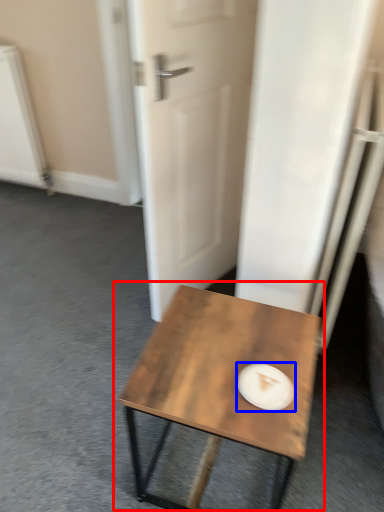
Question: Which of the following is the farthest to the observer, coffee table (highlighted by a red box) or paper plate (highlighted by a blue box)?

Choices:
 (A) coffee table
 (B) paper plate

Answer: (B)